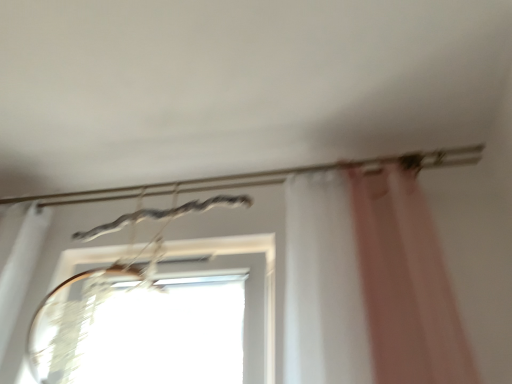
Question: Should I look upward or downward to see metallic wire at upper center?

Choices:
 (A) down
 (B) up

Answer: (B)

Question: Is there a large distance between metallic wire at upper center and transparent glass window at center?

Choices:
 (A) yes
 (B) no

Answer: (B)

Question: Is metallic wire at upper center not inside transparent glass window at center?

Choices:
 (A) no
 (B) yes

Answer: (B)

Question: From the image's perspective, is metallic wire at upper center below transparent glass window at center?

Choices:
 (A) yes
 (B) no

Answer: (B)

Question: From the image's perspective, is metallic wire at upper center on transparent glass window at center?

Choices:
 (A) yes
 (B) no

Answer: (A)

Question: From a real-world perspective, is metallic wire at upper center below transparent glass window at center?

Choices:
 (A) yes
 (B) no

Answer: (B)

Question: Does metallic wire at upper center have a lesser width compared to transparent glass window at center?

Choices:
 (A) yes
 (B) no

Answer: (A)

Question: Is transparent glass window at center looking in the opposite direction of metallic wire at upper center?

Choices:
 (A) no
 (B) yes

Answer: (A)

Question: Can you confirm if transparent glass window at center is smaller than metallic wire at upper center?

Choices:
 (A) yes
 (B) no

Answer: (B)

Question: From the image's perspective, is transparent glass window at center located above metallic wire at upper center?

Choices:
 (A) no
 (B) yes

Answer: (A)

Question: Would you say transparent glass window at center is a long distance from metallic wire at upper center?

Choices:
 (A) no
 (B) yes

Answer: (A)

Question: Is transparent glass window at center closer to the viewer compared to metallic wire at upper center?

Choices:
 (A) no
 (B) yes

Answer: (B)

Question: Does transparent glass window at center come behind metallic wire at upper center?

Choices:
 (A) no
 (B) yes

Answer: (A)

Question: Choose the correct answer: Is metallic wire at upper center inside transparent glass window at center or outside it?

Choices:
 (A) inside
 (B) outside

Answer: (B)